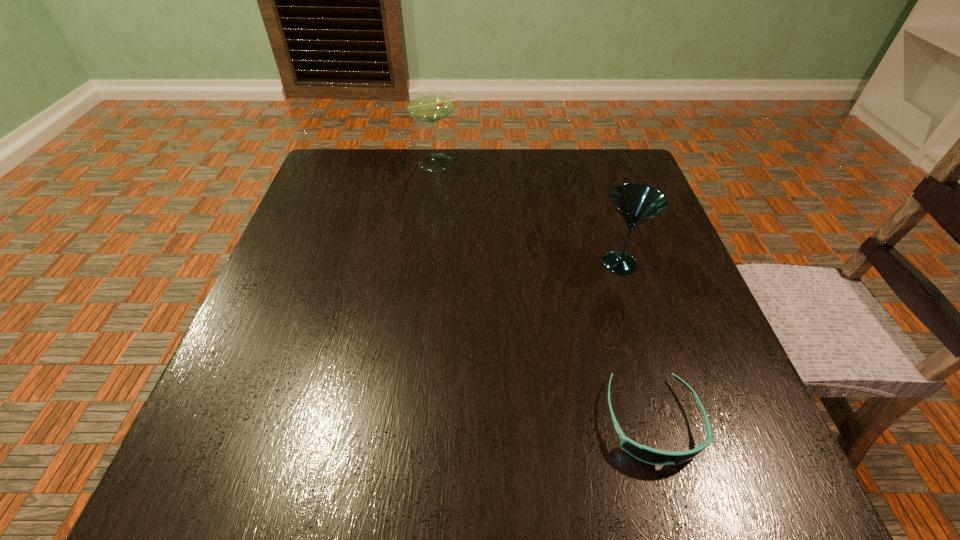
The width and height of the screenshot is (960, 540). I want to click on free space between the shorter martini and the shortest object, so click(x=636, y=342).

You are a GUI agent. You are given a task and a screenshot of the screen. Output one action in this format:
    pyautogui.click(x=<x>, y=<y>)
    Task: Click on the vacant area between the sunglasses and the farther martini
    This screenshot has width=960, height=540.
    Given the screenshot: What is the action you would take?
    pyautogui.click(x=544, y=292)

The height and width of the screenshot is (540, 960). Identify the location of free spot between the farthest object and the sunglasses. (544, 292).

You are a GUI agent. You are given a task and a screenshot of the screen. Output one action in this format:
    pyautogui.click(x=<x>, y=<y>)
    Task: Click on the free space between the second shortest object and the farther martini
    This screenshot has width=960, height=540.
    Given the screenshot: What is the action you would take?
    pyautogui.click(x=528, y=213)

What are the coordinates of `vacant space that's between the left martini and the shorter martini` in the screenshot? It's located at (528, 213).

What are the coordinates of `vacant space that's between the sunglasses and the farther martini` in the screenshot? It's located at (544, 292).

I want to click on free spot between the sunglasses and the second tallest object, so click(636, 342).

Find the location of a particular element. vacant space in between the sunglasses and the leftmost object is located at coordinates (544, 292).

Where is `vacant space that's between the left martini and the shortest object`? vacant space that's between the left martini and the shortest object is located at coordinates click(x=544, y=292).

Identify which object is located as the nearest to the farthest object. Please provide its 2D coordinates. Your answer should be formatted as a tuple, i.e. [(x, y)], where the tuple contains the x and y coordinates of a point satisfying the conditions above.

[(636, 203)]